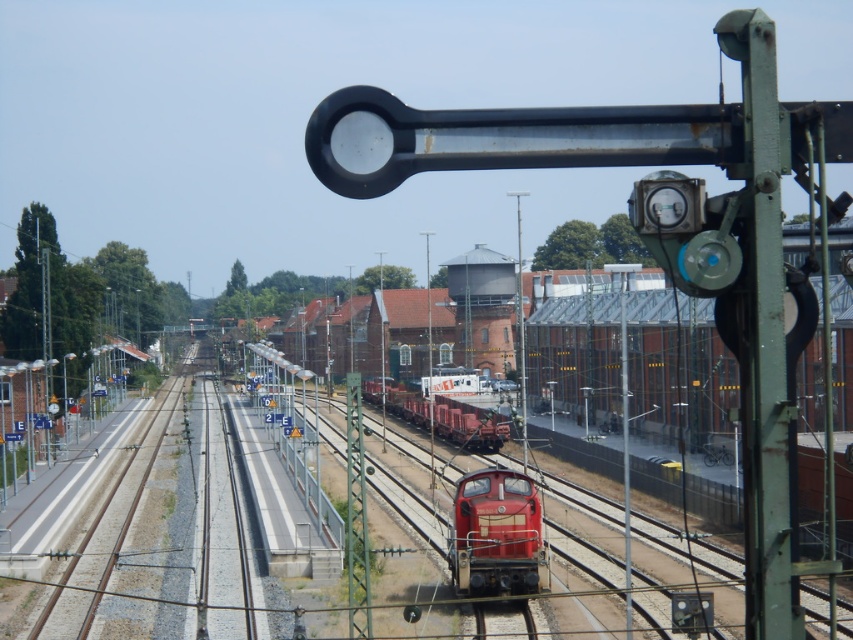
Question: Is shiny red locomotive at center thinner than matte red train at center?

Choices:
 (A) yes
 (B) no

Answer: (A)

Question: Does shiny red locomotive at center appear on the right side of matte red train at center?

Choices:
 (A) yes
 (B) no

Answer: (A)

Question: Can you confirm if shiny red locomotive at center is wider than matte red train at center?

Choices:
 (A) no
 (B) yes

Answer: (A)